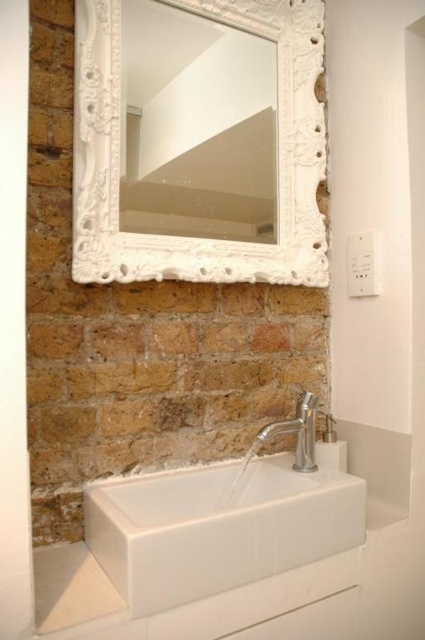
Can you confirm if white carved mirror at upper center is wider than silver metallic faucet at lower center?

Yes, white carved mirror at upper center is wider than silver metallic faucet at lower center.

Between white carved mirror at upper center and silver metallic faucet at lower center, which one has more height?

white carved mirror at upper center is taller.

The width and height of the screenshot is (425, 640). Find the location of `white carved mirror at upper center`. white carved mirror at upper center is located at coordinates (277, 154).

Is white glossy sink at center to the left of silver metallic faucet at lower center from the viewer's perspective?

Indeed, white glossy sink at center is positioned on the left side of silver metallic faucet at lower center.

Between point (181, 497) and point (263, 438), which one is positioned behind?

The point (181, 497) is more distant.

Who is more distant from viewer, (326, 506) or (294, 454)?

Point (294, 454)

In order to click on white glossy sink at center in this screenshot , I will do `click(218, 528)`.

Who is lower down, white carved mirror at upper center or white glossy sink at center?

white glossy sink at center is below.

Is point (78, 216) positioned after point (274, 486)?

No, it is in front of (274, 486).

Where is `white carved mirror at upper center`? This screenshot has width=425, height=640. white carved mirror at upper center is located at coordinates (277, 154).